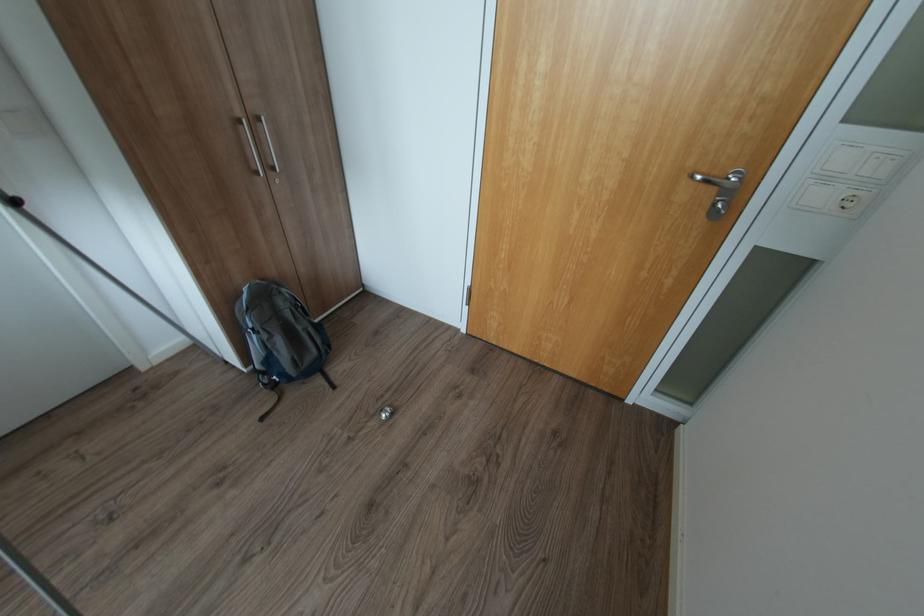
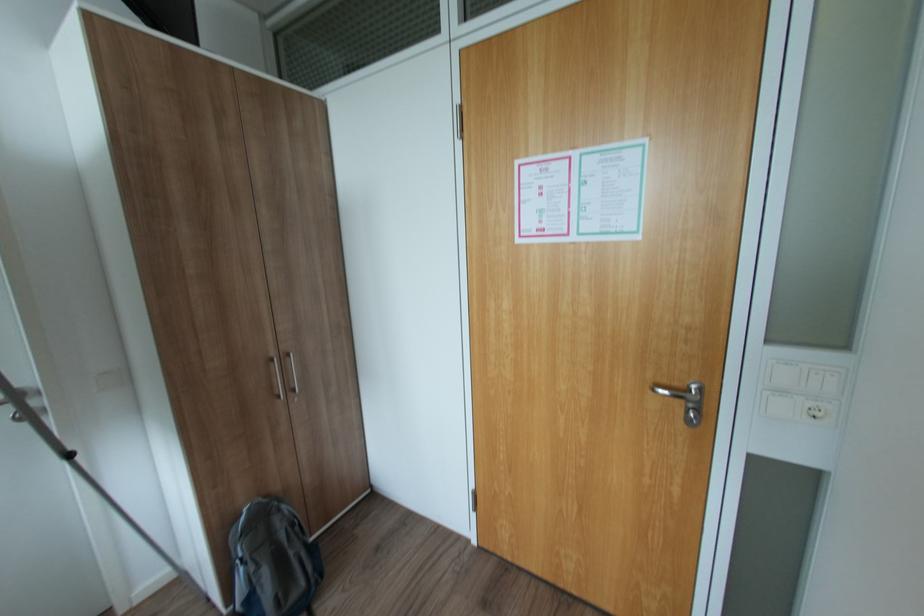
Where in the second image is the point corresponding to [852,205] from the first image?

(820, 414)